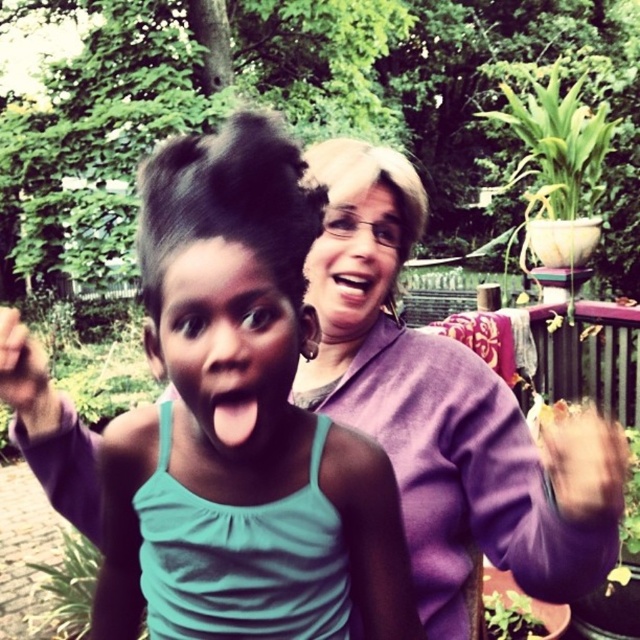
You are a photographer trying to capture a clear shot of the purple sweater at upper right and the smooth glossy mouth at center. Which object will appear closer to the camera in the photo?

The purple sweater at upper right is in front of the smooth glossy mouth at center, so it will appear closer to the camera in the photo.

You are holding a camera and want to take a photo of the scene. The camera has a focus range of 20 to 25 inches. Can you focus on the point at coordinates point (x=280, y=269)?

The distance between point (x=280, y=269) and the camera is 23.60 inches, which falls within the camera focus range of 20 to 25 inches. Therefore, the camera can focus on point (x=280, y=269).

What is the 2D coordinate of the green leafy plant at lower left in the image?

The green leafy plant at lower left is located at the 2D coordinate point of (68, 588).